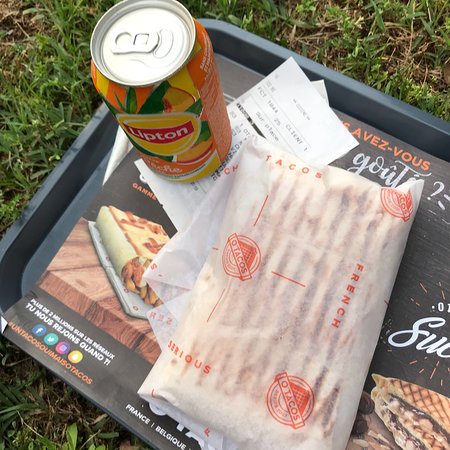
You are a GUI agent. You are given a task and a screenshot of the screen. Output one action in this format:
    pyautogui.click(x=<x>, y=<y>)
    Task: Click on the black carry tray
    The width and height of the screenshot is (450, 450).
    Given the screenshot: What is the action you would take?
    pyautogui.click(x=390, y=113)